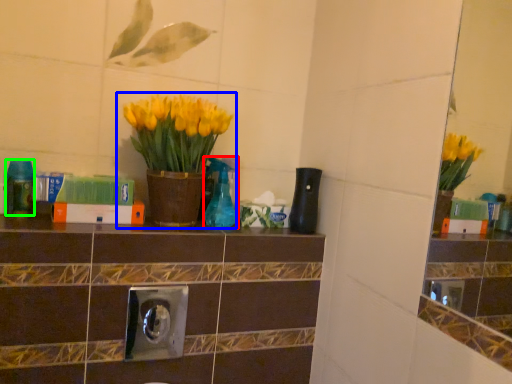
Question: Which object is positioned farthest from bottle (highlighted by a red box)? Select from houseplant (highlighted by a blue box) and bottle (highlighted by a green box).

Choices:
 (A) houseplant
 (B) bottle

Answer: (B)